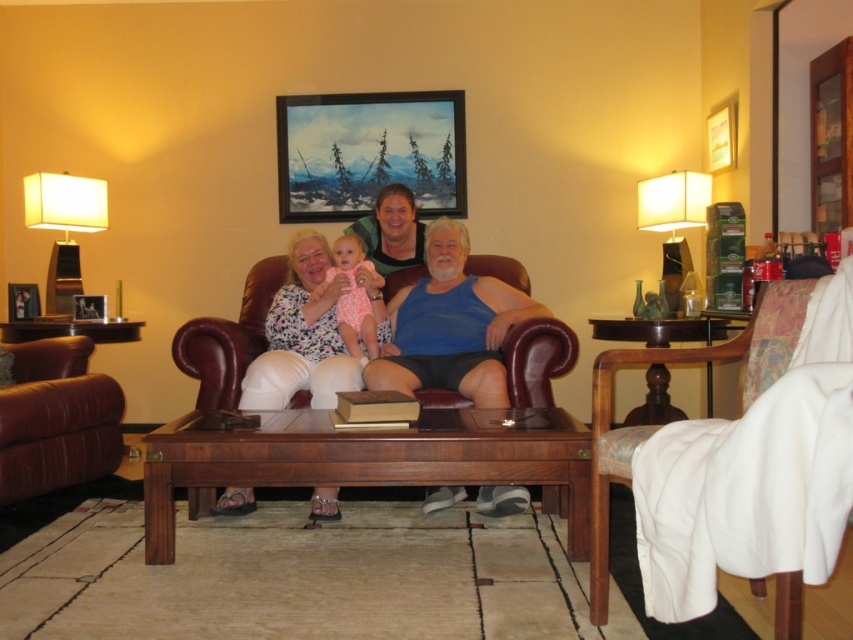
Question: Can you confirm if white fabric chair at right is positioned to the right of brushed metal picture frame at center?

Choices:
 (A) yes
 (B) no

Answer: (A)

Question: Which of these objects is positioned farthest from the brushed metal picture frame at center?

Choices:
 (A) white fabric lampshade at right
 (B) leather armchair at left

Answer: (A)

Question: Which is farther from the white fabric lampshade at left?

Choices:
 (A) pink floral onesie at center
 (B) blue tank top at center
 (C) painted wood picture frame at upper center
 (D) brushed metal picture frame at center

Answer: (B)

Question: Which point is closer to the camera?

Choices:
 (A) pink floral onesie at center
 (B) painted wood picture frame at upper center
 (C) white floral dress at center
 (D) brushed metal picture frame at center

Answer: (C)

Question: Observing the image, what is the correct spatial positioning of pink floral onesie at center in reference to brushed metal picture frame at center?

Choices:
 (A) below
 (B) above

Answer: (B)

Question: Can you confirm if matte blue tank top at center is positioned to the left of white floral dress at center?

Choices:
 (A) no
 (B) yes

Answer: (A)